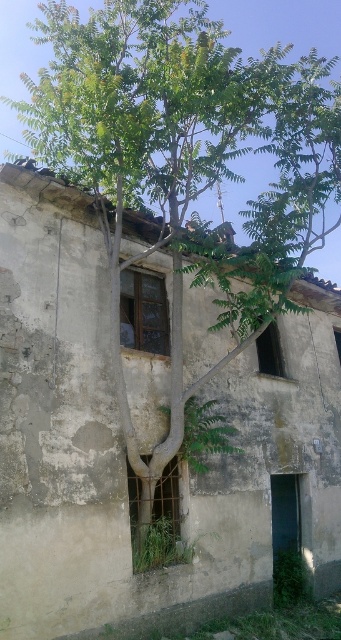
You are a maintenance worker assessing the building. You notice a wooden window frame at point (142, 310). Can you determine if this window is structurally sound given the tree growth? Please explain your reasoning based on the scene description.

The wooden window frame at point (142, 310) is at center left. The tree trunk is partially embedded into the building, which may have caused structural damage. Therefore, the window may not be structurally sound due to the tree growth affecting the building structure.

Looking at this image, you are an inspector checking the structural integrity of the old building. You notice a point at coordinates (155, 520) on the wall. What is located at that point?

The point at coordinates (155, 520) indicates metallic wire mesh at center.

You are a construction worker inspecting the building. You notice the metallic wire mesh at center. Where exactly is it located in terms of coordinates?

Answer: The metallic wire mesh at center is located at point (155, 520).